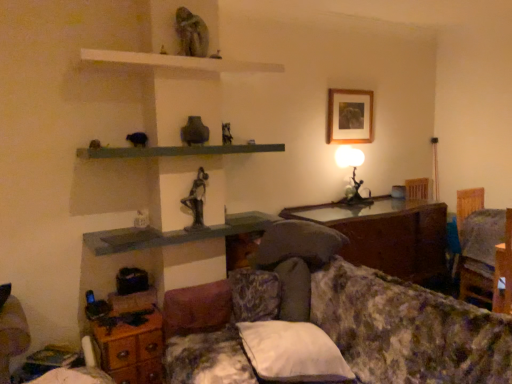
You are a GUI agent. You are given a task and a screenshot of the screen. Output one action in this format:
    pyautogui.click(x=<x>, y=<y>)
    Task: Click on the free location above wooden dresser at lower left (from a real-world perspective)
    The height and width of the screenshot is (384, 512).
    Given the screenshot: What is the action you would take?
    pyautogui.click(x=124, y=317)